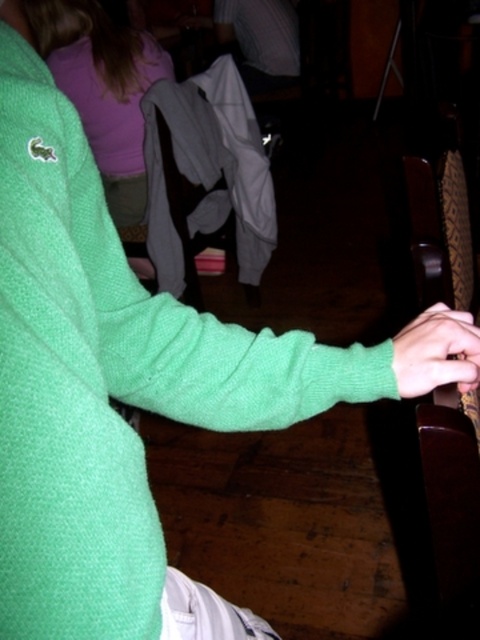
In the scene, there is a matte green sweater at upper left and a green fleece hand at lower right. From the perspective of someone standing in front of the scene, which object is positioned to the left of the other?

The matte green sweater at upper left is to the left of the green fleece hand at lower right.

You are standing in the room and want to reach the point marked at coordinates (168, 64). If you take a step forward of 1 meter, will you be closer to that point than 1.5 meters?

The point at coordinates (168, 64) is initially 2.34 meters away from you. After taking a 1 meter step forward, you would be 1.34 meters away, which is closer than 1.5 meters.